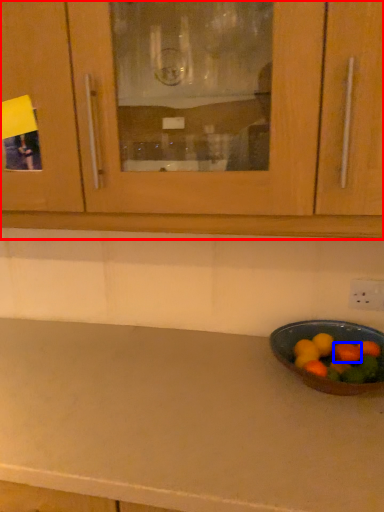
Question: Which of the following is the farthest to the observer, cabinetry (highlighted by a red box) or fruit (highlighted by a blue box)?

Choices:
 (A) cabinetry
 (B) fruit

Answer: (B)